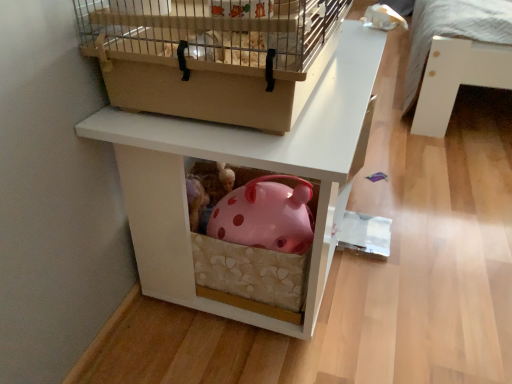
Question: Is pink polka dot piggy bank at center to the left or to the right of wooden birdcage at upper center in the image?

Choices:
 (A) right
 (B) left

Answer: (A)

Question: In the image, is pink polka dot piggy bank at center positioned in front of or behind wooden birdcage at upper center?

Choices:
 (A) behind
 (B) front

Answer: (A)

Question: Does point (317, 148) appear closer or farther from the camera than point (114, 61)?

Choices:
 (A) closer
 (B) farther

Answer: (A)

Question: From the image's perspective, is wooden birdcage at upper center located above or below pink polka dot piggy bank at center?

Choices:
 (A) below
 (B) above

Answer: (B)

Question: Considering the positions of wooden birdcage at upper center and pink polka dot piggy bank at center in the image, is wooden birdcage at upper center bigger or smaller than pink polka dot piggy bank at center?

Choices:
 (A) big
 (B) small

Answer: (B)

Question: From a real-world perspective, is wooden birdcage at upper center positioned above or below pink polka dot piggy bank at center?

Choices:
 (A) below
 (B) above

Answer: (B)

Question: In terms of height, does wooden birdcage at upper center look taller or shorter compared to pink polka dot piggy bank at center?

Choices:
 (A) short
 (B) tall

Answer: (A)